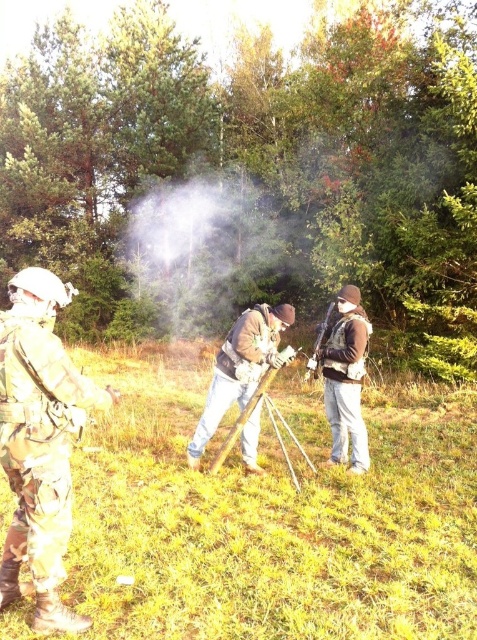
Does green grassy at center have a larger size compared to brown leather backpack at center?

Indeed, green grassy at center has a larger size compared to brown leather backpack at center.

Does point (100, 604) lie in front of point (238, 360)?

Yes, it is in front of point (238, 360).

Describe the element at coordinates (271, 522) in the screenshot. I see `green grassy at center` at that location.

I want to click on green grassy at center, so click(x=271, y=522).

How distant is camouflage uniform at center from wooden tripod at center?

26.42 inches

Describe the element at coordinates (345, 380) in the screenshot. I see `camouflage uniform at center` at that location.

Which is in front, point (334, 416) or point (261, 397)?

Point (261, 397) is more forward.

The height and width of the screenshot is (640, 477). I want to click on camouflage uniform at center, so click(x=345, y=380).

Is wooden tripod at center in front of matte black rifle at center?

Yes.

Does point (248, 401) come farther from viewer compared to point (327, 310)?

No.

Which is behind, point (256, 406) or point (333, 305)?

Point (333, 305)

The height and width of the screenshot is (640, 477). I want to click on wooden tripod at center, so click(270, 420).